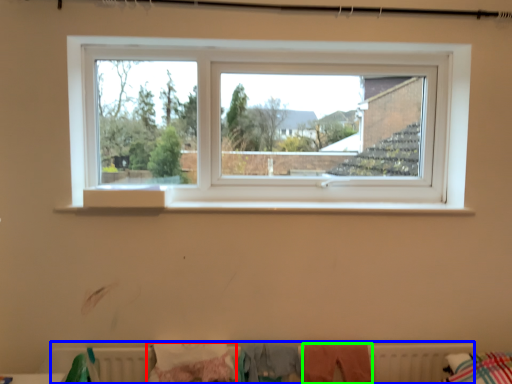
Question: Which object is positioned closest to clothing (highlighted by a red box)? Select from radiator (highlighted by a blue box) and clothing (highlighted by a green box).

Choices:
 (A) radiator
 (B) clothing

Answer: (A)